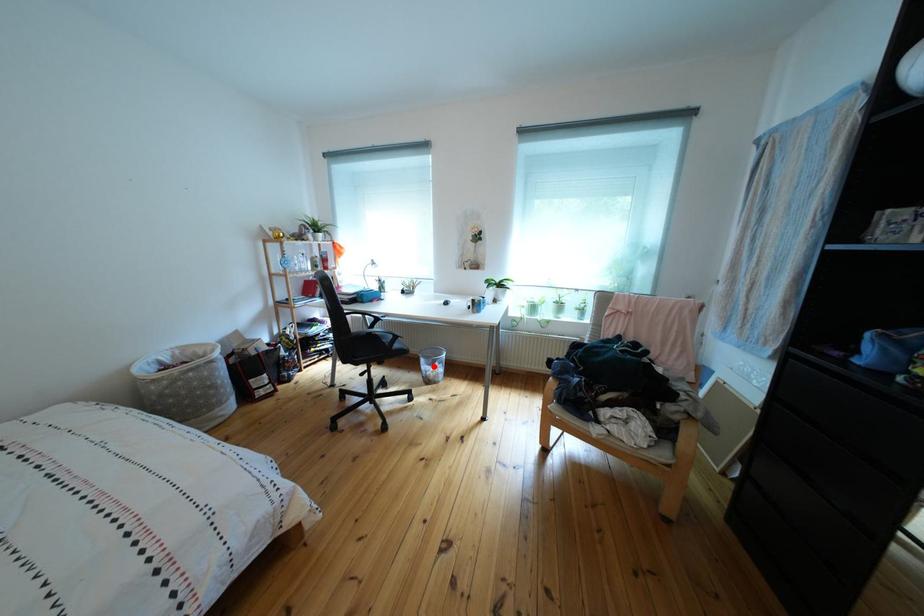
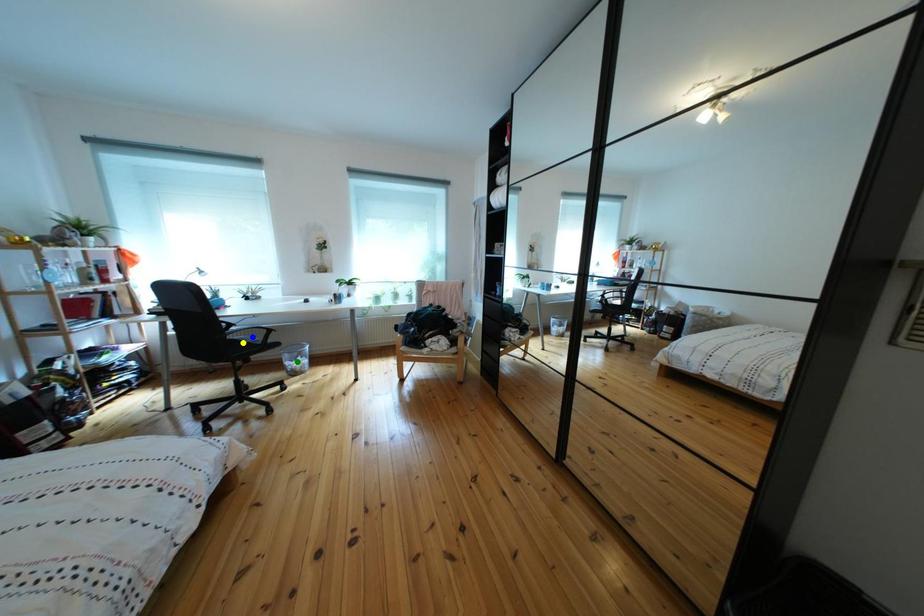
Question: I am providing you with two images of the same scene from different viewpoints. A red point is marked on the first image. You are given multiple points on the second image. Can you choose the point in image 2 that corresponds to the point in image 1?

Choices:
 (A) green point
 (B) yellow point
 (C) blue point

Answer: (A)